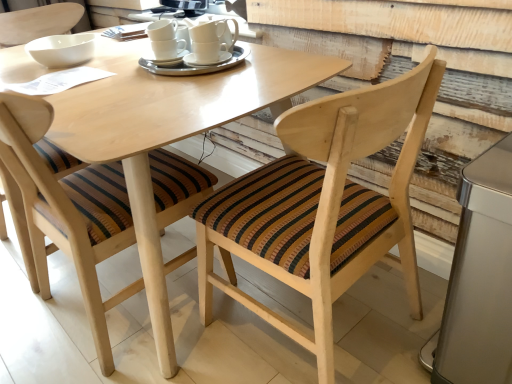
Question: From the image's perspective, is white ceramic saucer at center over white ceramic cups at center, which ranks as the 2th tableware in left-to-right order?

Choices:
 (A) yes
 (B) no

Answer: (B)

Question: Is white ceramic saucer at center to the left of white ceramic cups at center, which ranks as the 2th tableware in left-to-right order, from the viewer's perspective?

Choices:
 (A) no
 (B) yes

Answer: (A)

Question: Is white ceramic saucer at center oriented towards white ceramic cups at center, which ranks as the 2th tableware in left-to-right order?

Choices:
 (A) yes
 (B) no

Answer: (A)

Question: Is white ceramic saucer at center shorter than white ceramic cups at center, which ranks as the 2th tableware in left-to-right order?

Choices:
 (A) no
 (B) yes

Answer: (B)

Question: Is white ceramic saucer at center facing away from white ceramic cups at center, which ranks as the 2th tableware in left-to-right order?

Choices:
 (A) no
 (B) yes

Answer: (B)

Question: Considering the positions of white ceramic saucer at center and wooden chair with striped cushion at center, the 2th chair from the right, in the image, is white ceramic saucer at center taller or shorter than wooden chair with striped cushion at center, the 2th chair from the right,?

Choices:
 (A) short
 (B) tall

Answer: (A)

Question: Visually, is white ceramic saucer at center positioned to the left or to the right of wooden chair with striped cushion at center, the 2th chair from the right?

Choices:
 (A) right
 (B) left

Answer: (A)

Question: Do you think white ceramic saucer at center is within wooden chair with striped cushion at center, which appears as the first chair when viewed from the left, or outside of it?

Choices:
 (A) outside
 (B) inside

Answer: (A)

Question: Is white ceramic saucer at center wider or thinner than wooden chair with striped cushion at center, the 2th chair from the right?

Choices:
 (A) thin
 (B) wide

Answer: (A)

Question: In terms of size, does white ceramic cups at center, positioned as the 1th tableware in right-to-left order, appear bigger or smaller than white ceramic saucer at center?

Choices:
 (A) big
 (B) small

Answer: (A)

Question: In the image, is white ceramic cups at center, positioned as the 1th tableware in right-to-left order, positioned in front of or behind white ceramic saucer at center?

Choices:
 (A) behind
 (B) front

Answer: (B)

Question: From a real-world perspective, is white ceramic cups at center, positioned as the 1th tableware in right-to-left order, physically located above or below white ceramic saucer at center?

Choices:
 (A) above
 (B) below

Answer: (B)

Question: Is point click(x=161, y=72) closer or farther from the camera than point click(x=187, y=61)?

Choices:
 (A) farther
 (B) closer

Answer: (B)

Question: Would you say silver metallic trash can at lower right is to the left or to the right of white ceramic cup at center in the picture?

Choices:
 (A) left
 (B) right

Answer: (B)

Question: Choose the correct answer: Is silver metallic trash can at lower right inside white ceramic cup at center or outside it?

Choices:
 (A) outside
 (B) inside

Answer: (A)